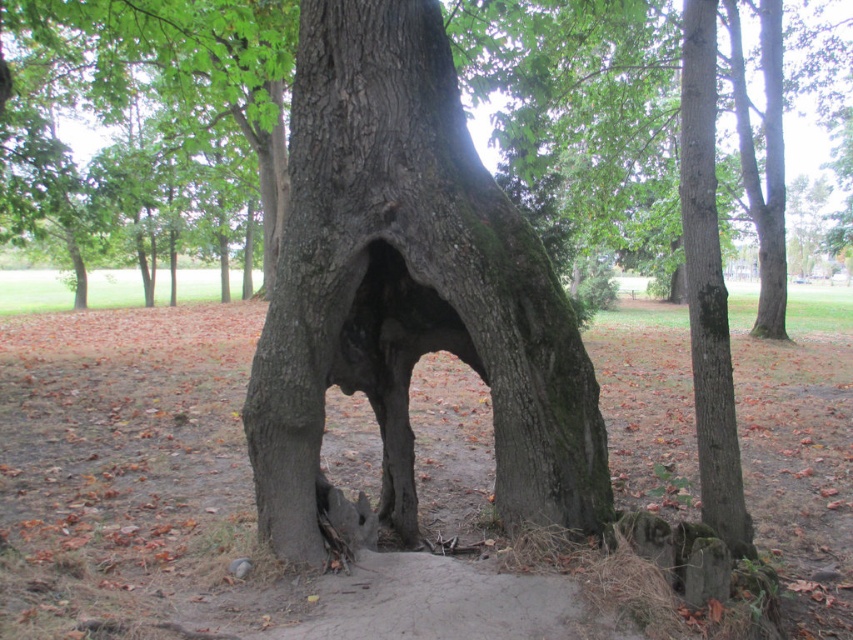
Is smooth bark tree trunk at center to the right of smooth bark tree trunk at right from the viewer's perspective?

Incorrect, smooth bark tree trunk at center is not on the right side of smooth bark tree trunk at right.

Between smooth bark tree trunk at center and smooth bark tree trunk at right, which one has less height?

Standing shorter between the two is smooth bark tree trunk at right.

Is point (526, 310) behind point (688, 189)?

Yes, it is.

I want to click on smooth bark tree trunk at center, so click(408, 289).

Who is shorter, smooth bark tree trunk at center or dark gray bark hole at center?

Standing shorter between the two is dark gray bark hole at center.

Is smooth bark tree trunk at center below dark gray bark hole at center?

No.

I want to click on smooth bark tree trunk at center, so click(408, 289).

Does smooth bark tree trunk at right have a greater height compared to dark gray bark hole at center?

Yes, smooth bark tree trunk at right is taller than dark gray bark hole at center.

What do you see at coordinates (708, 289) in the screenshot? I see `smooth bark tree trunk at right` at bounding box center [708, 289].

Identify the location of smooth bark tree trunk at right. (708, 289).